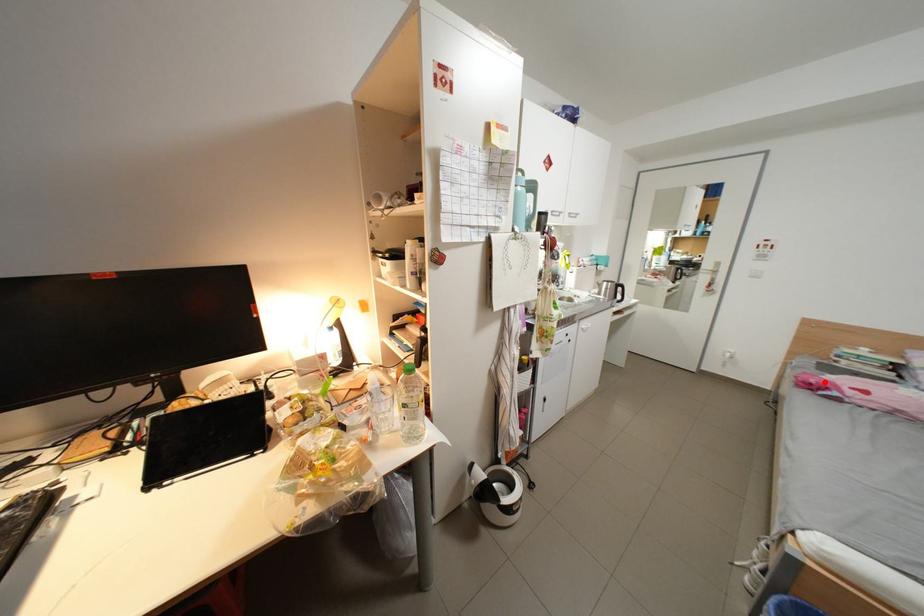
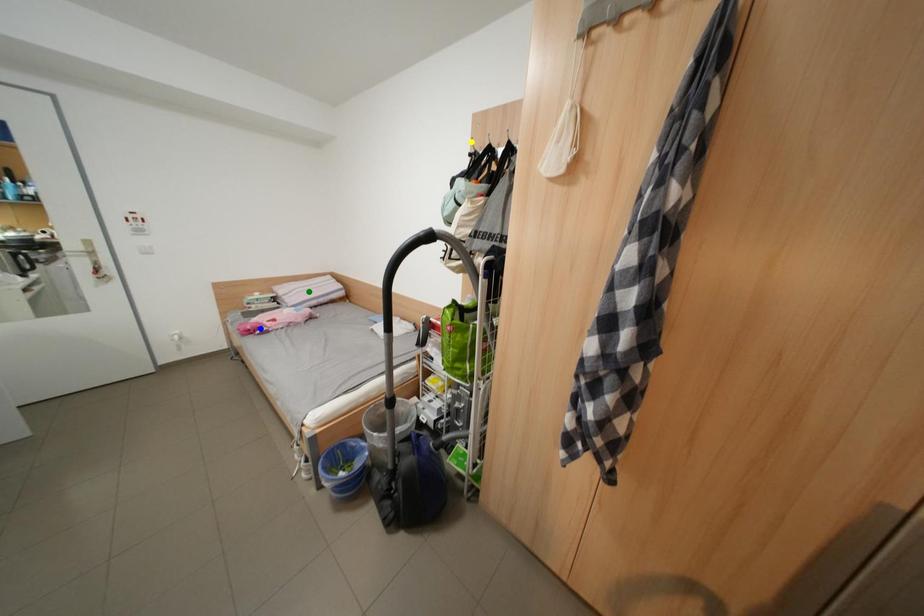
Question: I am providing you with two images of the same scene from different viewpoints. A red point is marked on the first image. You are given multiple points on the second image. In image 2, which mark is for the same physical point as the one in image 1?

Choices:
 (A) blue point
 (B) yellow point
 (C) green point

Answer: (A)